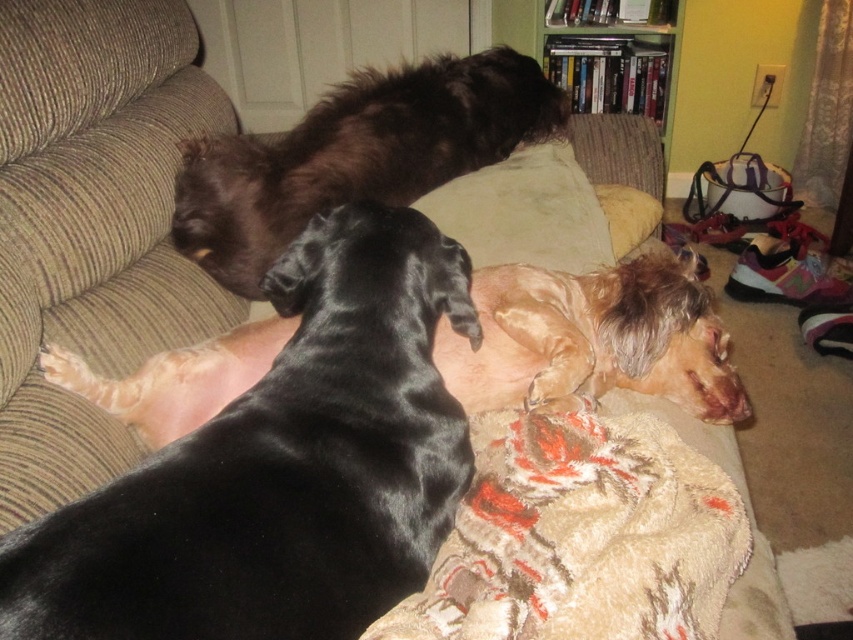
Between point (665, 536) and point (422, 109), which one is positioned behind?

Positioned behind is point (422, 109).

What do you see at coordinates (582, 534) in the screenshot?
I see `beige knitted blanket at center` at bounding box center [582, 534].

Locate an element on the screen. This screenshot has width=853, height=640. beige knitted blanket at center is located at coordinates (582, 534).

Which of these two, shiny black dog at center or shiny black dog at upper center, stands shorter?

shiny black dog at center

Between shiny black dog at center and shiny black dog at upper center, which one appears on the right side from the viewer's perspective?

Positioned to the right is shiny black dog at center.

Measure the distance between point (502, 406) and camera.

Point (502, 406) is 1.17 meters away from camera.

Find the location of a particular element. shiny black dog at center is located at coordinates (593, 339).

Based on the photo, who is taller, brown fabric couch at center or beige knitted blanket at center?

Standing taller between the two is brown fabric couch at center.

Image resolution: width=853 pixels, height=640 pixels. I want to click on brown fabric couch at center, so click(x=91, y=225).

The height and width of the screenshot is (640, 853). Identify the location of brown fabric couch at center. (91, 225).